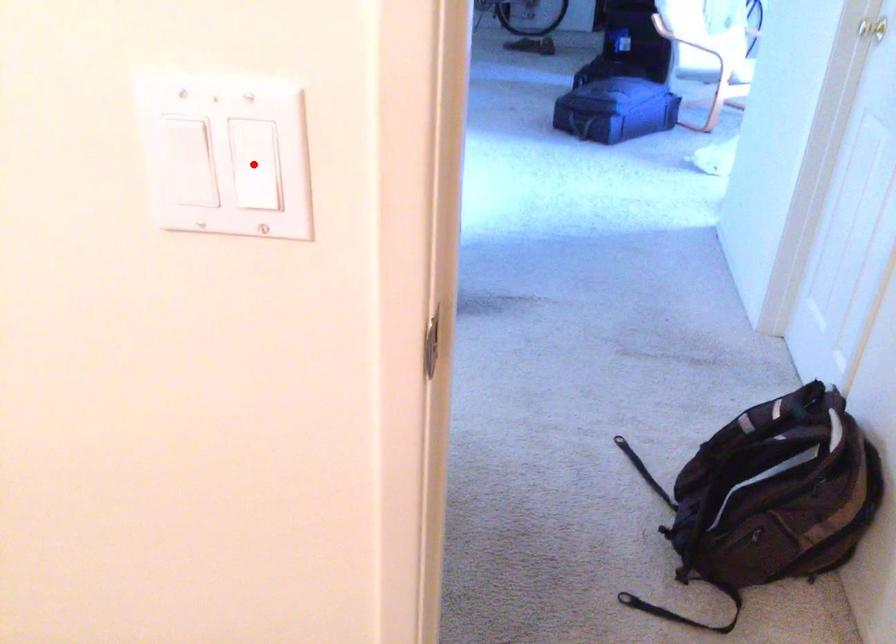
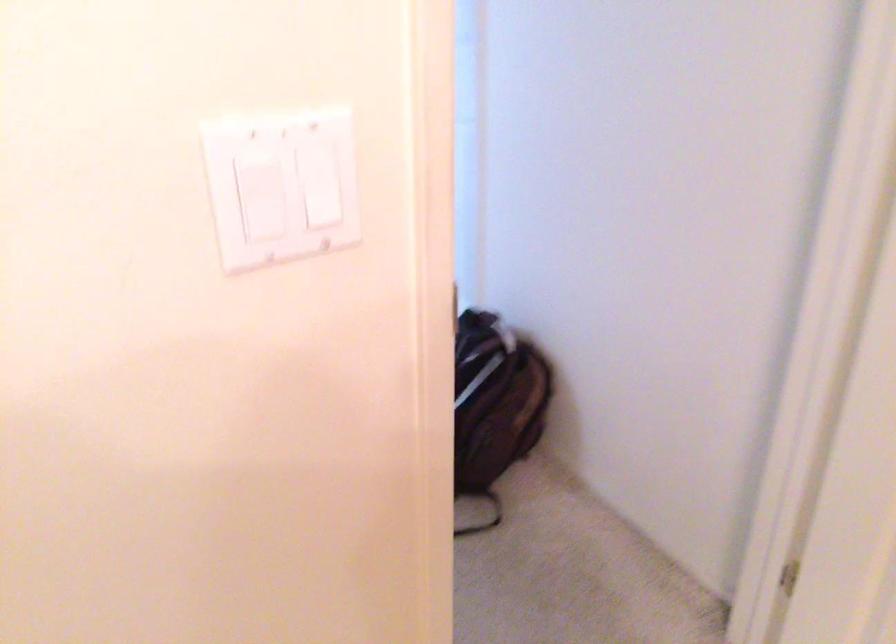
Find the pixel in the second image that matches the highlighted location in the first image.

(326, 192)